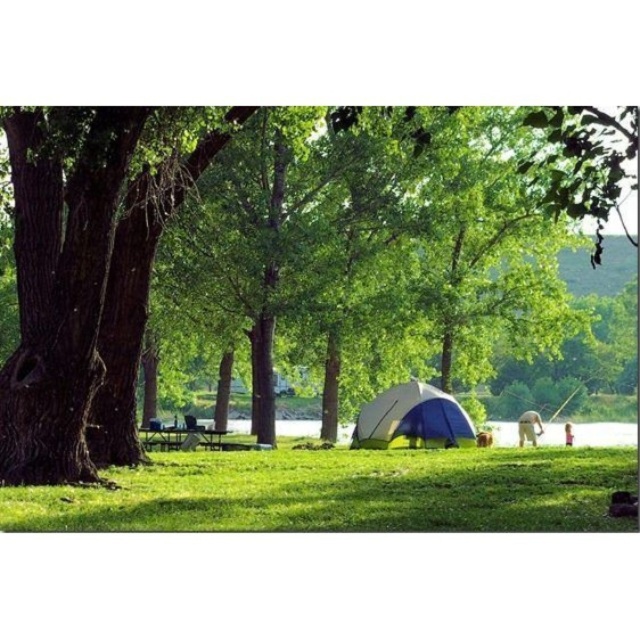
Does dark brown bark tree at left have a greater height compared to white/blue fabric tent at center?

In fact, dark brown bark tree at left may be shorter than white/blue fabric tent at center.

Can you confirm if dark brown bark tree at left is wider than white/blue fabric tent at center?

No, dark brown bark tree at left is not wider than white/blue fabric tent at center.

Does point (54, 172) come in front of point (426, 422)?

Yes, point (54, 172) is in front of point (426, 422).

The height and width of the screenshot is (640, 640). I want to click on dark brown bark tree at left, so click(83, 285).

Who is positioned more to the right, dark brown bark tree at left or green grass at lower center?

green grass at lower center

Which is above, dark brown bark tree at left or green grass at lower center?

dark brown bark tree at left is higher up.

I want to click on dark brown bark tree at left, so click(x=83, y=285).

Does white/blue fabric tent at center lie in front of green matte picnic table at center?

No, white/blue fabric tent at center is further to the viewer.

Who is more forward, [388,413] or [211,428]?

Point [388,413]

Between point (420, 445) and point (209, 445), which one is positioned in front?

Point (420, 445)

The image size is (640, 640). In order to click on white/blue fabric tent at center in this screenshot , I will do `click(412, 419)`.